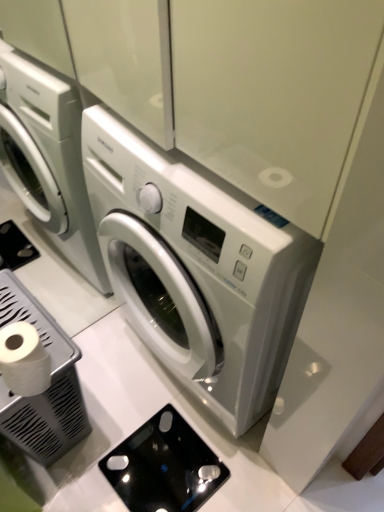
At what (x,y) coordinates should I click in order to perform the action: click on empty space that is in between black glass scale at lower center, which is the first appliance in right-to-left order, and white plastic trash can at lower left, which is counted as the first appliance, starting from the left. Please return your answer as a coordinate pair (x, y). This screenshot has width=384, height=512. Looking at the image, I should click on (118, 424).